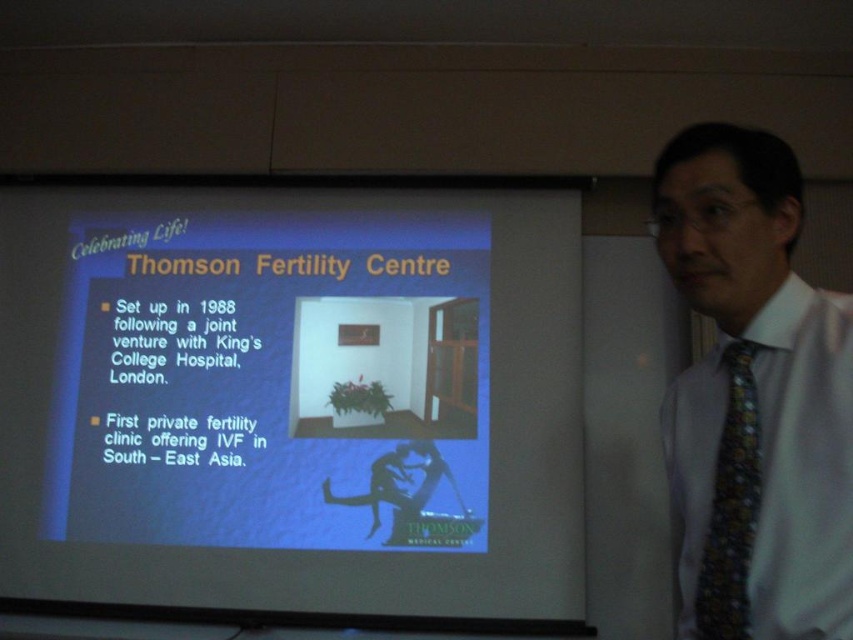
You are an attendee at a presentation and want to take a photo of the blue matte screen at center and the multicolored patterned tie at right. Which object should you focus on first to ensure both are in the frame?

The blue matte screen at center is positioned on the left side of multicolored patterned tie at right, so you should focus on the blue matte screen at center first to ensure both are in the frame.

Based on the photo, you are an event photographer at the Thomson Fertility Centre presentation. You need to capture a photo of the presenter wearing a white silk shirt at right and a multicolored patterned tie at right. Which clothing item will appear taller in the photo?

The white silk shirt at right will appear taller in the photo because it has a greater height compared to the multicolored patterned tie at right.

Consider the image. Based on the scene description, what is the significance of the point located at coordinates [753,397]?

The point at coordinates [753,397] is on the white silk shirt at right, indicating its position relative to the person standing in the frame.